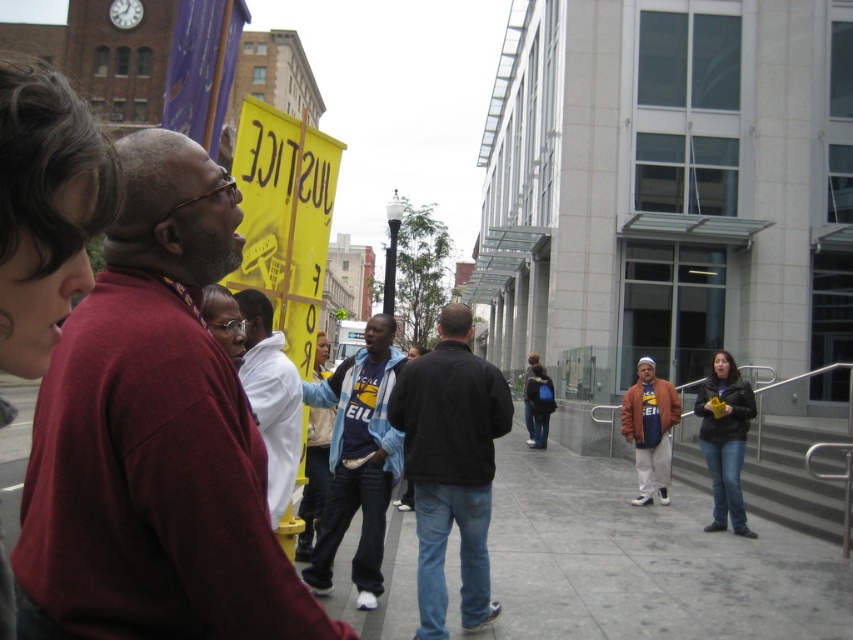
You are a photographer trying to capture a photo of the protest scene. You want to ensure the maroon sweater at left is positioned in the lower third of the frame. Based on its current coordinates, will it fit within this area?

The maroon sweater at left is located at coordinates point (x=154, y=436). Since the lower third of the frame typically occupies the bottom one third of the image, the y coordinate of 0.182 falls within this region. Therefore, it will fit within the desired area.

You are part of a protest group and need to identify the clothing items for a report. Which clothing item is positioned to the right of the other between the denim jacket at lower right and the blue denim jeans at center?

The denim jacket at lower right is positioned to the right of the blue denim jeans at center.